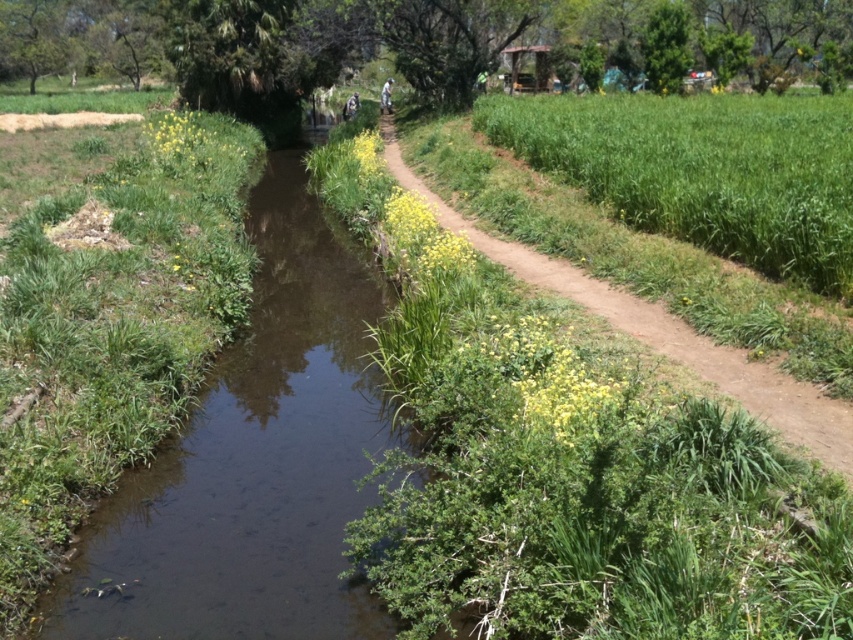
Is green grass at right positioned before dirt path at center?

No, it is behind dirt path at center.

Who is shorter, green grass at right or dirt path at center?

Standing shorter between the two is dirt path at center.

Does point (581, 109) lie behind point (635, 317)?

That is True.

What are the coordinates of `green grass at right` in the screenshot? It's located at (703, 170).

Can you confirm if brown muddy stream at center is taller than dirt path at center?

No, brown muddy stream at center is not taller than dirt path at center.

Is brown muddy stream at center positioned behind dirt path at center?

Yes, brown muddy stream at center is further from the viewer.

Who is more forward, (341,257) or (822,419)?

Point (822,419) is more forward.

At what (x,y) coordinates should I click in order to perform the action: click on brown muddy stream at center. Please return your answer as a coordinate pair (x, y). Looking at the image, I should click on (254, 460).

Can you confirm if brown muddy stream at center is positioned to the right of green grass at right?

In fact, brown muddy stream at center is to the left of green grass at right.

Which is in front, point (280, 276) or point (682, 138)?

Positioned in front is point (682, 138).

Where is `brown muddy stream at center`? The height and width of the screenshot is (640, 853). brown muddy stream at center is located at coordinates (254, 460).